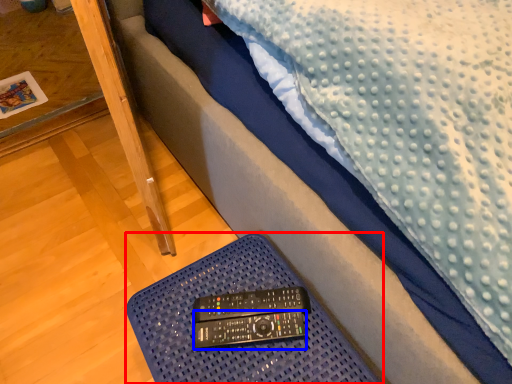
Question: Which point is closer to the camera, furniture (highlighted by a red box) or control (highlighted by a blue box)?

Choices:
 (A) furniture
 (B) control

Answer: (A)